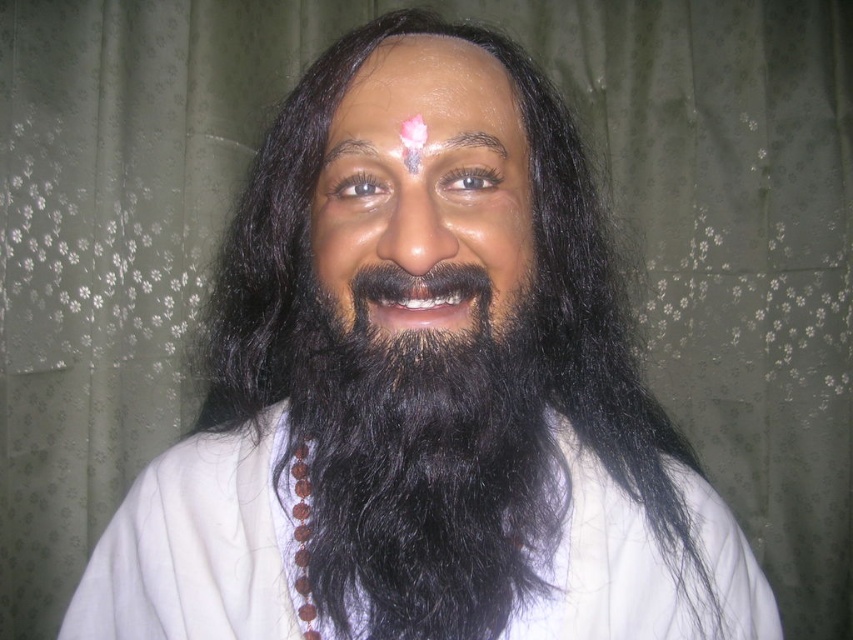
Question: Which point is farther to the camera?

Choices:
 (A) smooth skin face at center
 (B) matte skin forehead at center
 (C) dark brown hair at upper center
 (D) brown hair at upper center

Answer: (C)

Question: Does smooth skin face at center have a larger size compared to matte skin forehead at center?

Choices:
 (A) yes
 (B) no

Answer: (A)

Question: Which object is farther from the camera taking this photo?

Choices:
 (A) matte skin forehead at center
 (B) smooth skin face at center
 (C) black fuzzy beard at center

Answer: (A)

Question: Considering the relative positions of white cloth at center and brown hair at upper center in the image provided, where is white cloth at center located with respect to brown hair at upper center?

Choices:
 (A) above
 (B) below

Answer: (B)

Question: Is black fuzzy beard at center to the left of matte skin forehead at center from the viewer's perspective?

Choices:
 (A) no
 (B) yes

Answer: (B)

Question: Which object is positioned closest to the white cloth at center?

Choices:
 (A) brown hair at upper center
 (B) black fuzzy beard at center

Answer: (B)